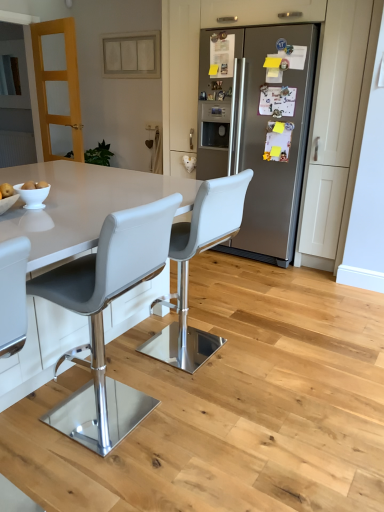
What are the coordinates of `unoccupied region to the right of white leather stool at center, the second chair positioned from the back` in the screenshot? It's located at (205, 424).